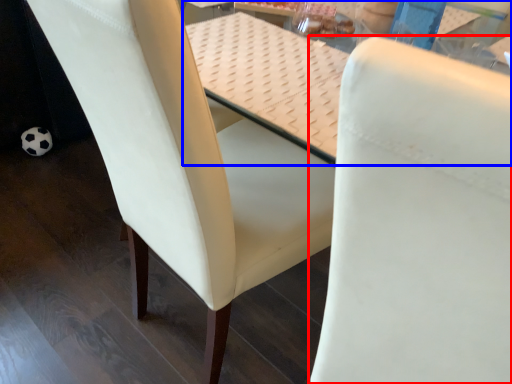
Question: Which point is further to the camera, chair (highlighted by a red box) or table (highlighted by a blue box)?

Choices:
 (A) chair
 (B) table

Answer: (B)